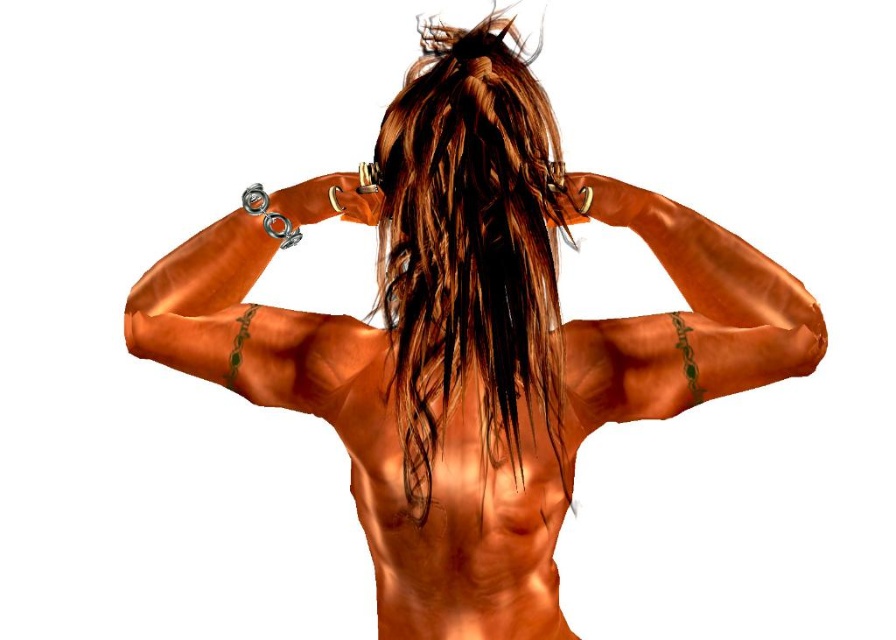
Is brown shiny hair at center bigger than satin-like skin at upper right?

Yes, brown shiny hair at center is bigger than satin-like skin at upper right.

Looking at this image, which of these two, brown shiny hair at center or satin-like skin at upper right, stands taller?

With more height is brown shiny hair at center.

Who is more forward, (471, 81) or (773, 326)?

Positioned in front is point (471, 81).

Locate an element on the screen. brown shiny hair at center is located at coordinates click(x=471, y=248).

Is point (645, 339) positioned behind point (208, 317)?

No, it is in front of (208, 317).

Identify the location of satin-like skin at upper right. This screenshot has height=640, width=896. (685, 316).

The width and height of the screenshot is (896, 640). Identify the location of satin-like skin at upper right. (685, 316).

Can you confirm if brown shiny hair at center is thinner than shiny metallic bicep at center?

Yes.

Based on the photo, who is positioned more to the left, brown shiny hair at center or shiny metallic bicep at center?

From the viewer's perspective, shiny metallic bicep at center appears more on the left side.

Which is behind, point (416, 486) or point (334, 330)?

Point (334, 330)

I want to click on brown shiny hair at center, so (471, 248).